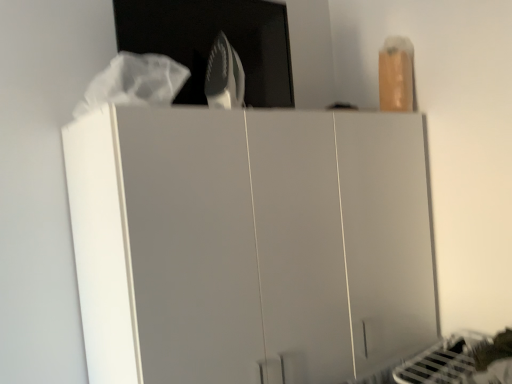
Image resolution: width=512 pixels, height=384 pixels. What do you see at coordinates (249, 243) in the screenshot?
I see `white matte cupboard at center` at bounding box center [249, 243].

This screenshot has width=512, height=384. What are the coordinates of `white matte cupboard at center` in the screenshot? It's located at (249, 243).

Image resolution: width=512 pixels, height=384 pixels. In order to click on white matte cupboard at center in this screenshot , I will do `click(249, 243)`.